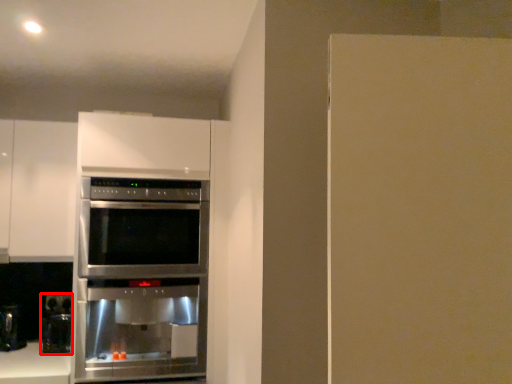
Question: From the image's perspective, considering the relative positions of coffee machine (annotated by the red box) and oven in the image provided, where is coffee machine (annotated by the red box) located with respect to the staircase?

Choices:
 (A) below
 (B) above

Answer: (A)